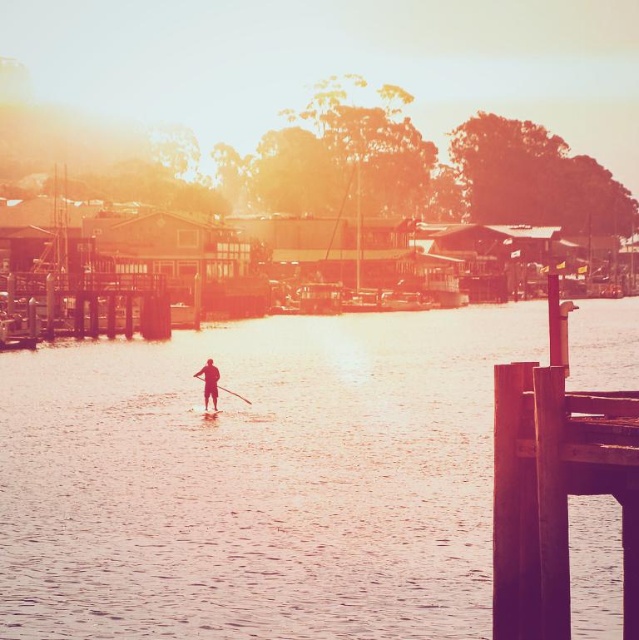
Question: Can you confirm if transparent water at center is bigger than wooden canoe at center?

Choices:
 (A) no
 (B) yes

Answer: (B)

Question: Does wooden canoe at center lie behind brown wooden paddle at center?

Choices:
 (A) yes
 (B) no

Answer: (B)

Question: Can you confirm if wooden dock at right is positioned to the right of wooden canoe at center?

Choices:
 (A) yes
 (B) no

Answer: (A)

Question: Which point is closer to the camera taking this photo?

Choices:
 (A) (196, 372)
 (B) (210, 417)
 (C) (633, 625)
 (D) (452, 529)

Answer: (C)

Question: Based on their relative distances, which object is farther from the brown wooden paddle at center?

Choices:
 (A) wooden canoe at center
 (B) smooth skin paddleboarder at center
 (C) wooden dock at right

Answer: (C)

Question: Which object is farther from the camera taking this photo?

Choices:
 (A) wooden canoe at center
 (B) wooden dock at right

Answer: (A)